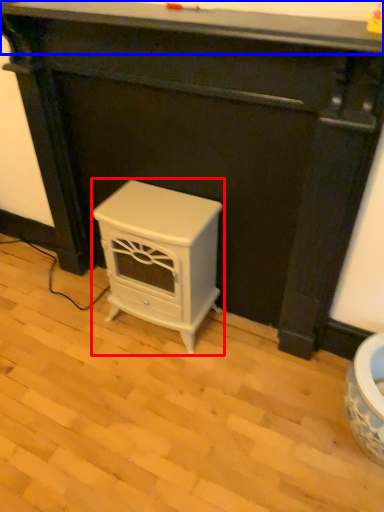
Question: Which point is closer to the camera, furniture (highlighted by a red box) or counter top (highlighted by a blue box)?

Choices:
 (A) furniture
 (B) counter top

Answer: (B)